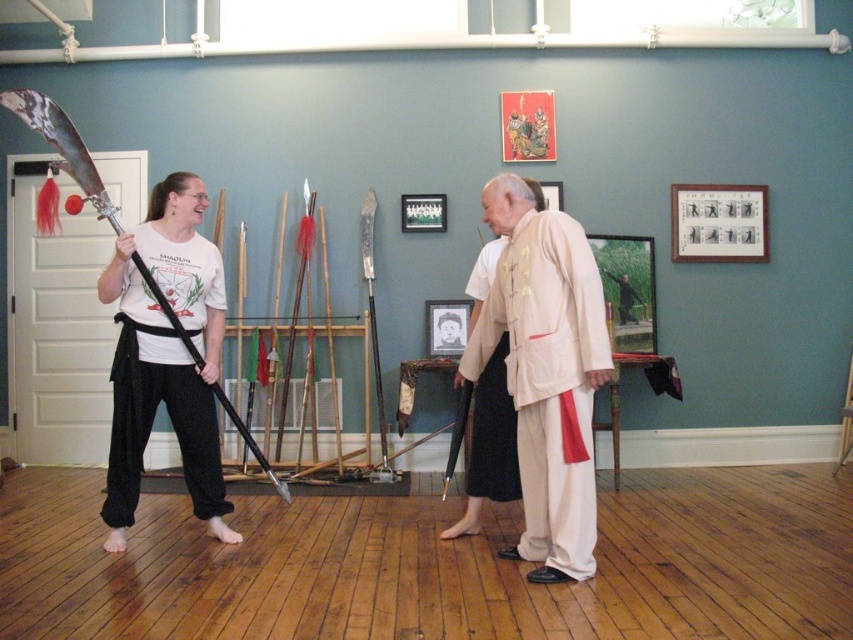
You are a martial arts instructor observing the two individuals in the dojo. You need to move between the beige cotton robe at center and the light beige silk robe at center to adjust their stances. Can you comfortably walk between them without needing to move either robe?

The distance between the beige cotton robe at center and the light beige silk robe at center is 15.59 inches. Since this distance is quite narrow, it would be difficult to comfortably walk between them without moving at least one of the robes.

You are a photographer positioned at the camera. You want to capture a closeup shot of the black cotton robe at left. Given that you are currently 11.29 feet away from it, is this distance sufficient to focus on the robe clearly?

The black cotton robe at left is 11.29 feet away from the camera. This distance may be too far for a closeup shot, so you might need to move closer to ensure the robe is in focus and properly detailed.

You are a martial arts instructor standing in the center of the room. You need to move to the black cotton robe at left and the light beige silk robe at center to adjust their positions. Which robe is closer to your current position?

The light beige silk robe at center is closer to your current position because you are standing in the center, and the black cotton robe at left is 1.44 meters away from it.